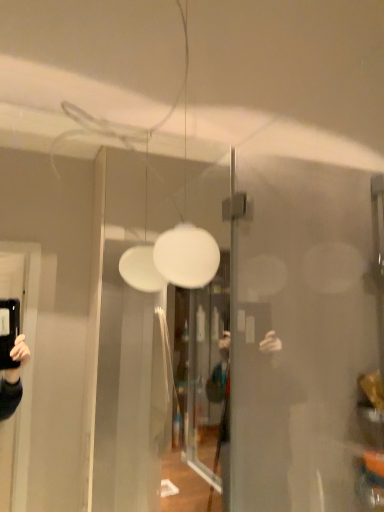
Question: Would you say white matte sphere at center is a long distance from transparent glass door at center?

Choices:
 (A) no
 (B) yes

Answer: (B)

Question: From the image's perspective, is white matte sphere at center located beneath transparent glass door at center?

Choices:
 (A) no
 (B) yes

Answer: (A)

Question: Does white matte sphere at center have a lesser height compared to transparent glass door at center?

Choices:
 (A) no
 (B) yes

Answer: (B)

Question: From a real-world perspective, does white matte sphere at center sit lower than transparent glass door at center?

Choices:
 (A) yes
 (B) no

Answer: (B)

Question: Does white matte sphere at center have a larger size compared to transparent glass door at center?

Choices:
 (A) yes
 (B) no

Answer: (B)

Question: Is white matte sphere at center positioned in front of transparent glass door at center?

Choices:
 (A) yes
 (B) no

Answer: (B)

Question: Does transparent glass door at center appear on the right side of white matte sphere at center?

Choices:
 (A) yes
 (B) no

Answer: (B)

Question: From a real-world perspective, is transparent glass door at center physically below white matte sphere at center?

Choices:
 (A) no
 (B) yes

Answer: (B)

Question: Considering the relative sizes of transparent glass door at center and white matte sphere at center in the image provided, is transparent glass door at center bigger than white matte sphere at center?

Choices:
 (A) no
 (B) yes

Answer: (B)

Question: Is transparent glass door at center positioned beyond the bounds of white matte sphere at center?

Choices:
 (A) no
 (B) yes

Answer: (B)

Question: Does transparent glass door at center contain white matte sphere at center?

Choices:
 (A) yes
 (B) no

Answer: (B)

Question: Is the position of transparent glass door at center less distant than that of white matte sphere at center?

Choices:
 (A) no
 (B) yes

Answer: (B)

Question: Looking at the image, does transparent glass door at center seem bigger or smaller compared to white matte sphere at center?

Choices:
 (A) big
 (B) small

Answer: (A)